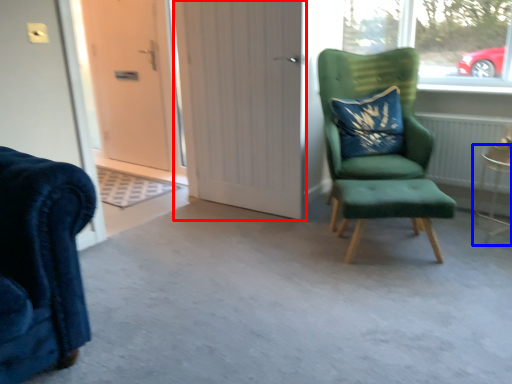
Question: Which object is further to the camera taking this photo, door (highlighted by a red box) or side table (highlighted by a blue box)?

Choices:
 (A) door
 (B) side table

Answer: (A)